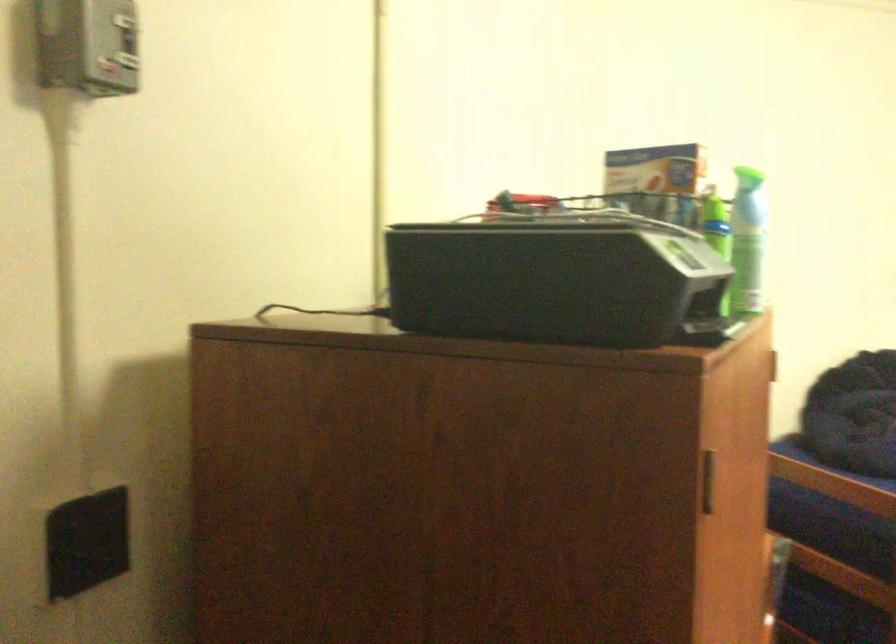
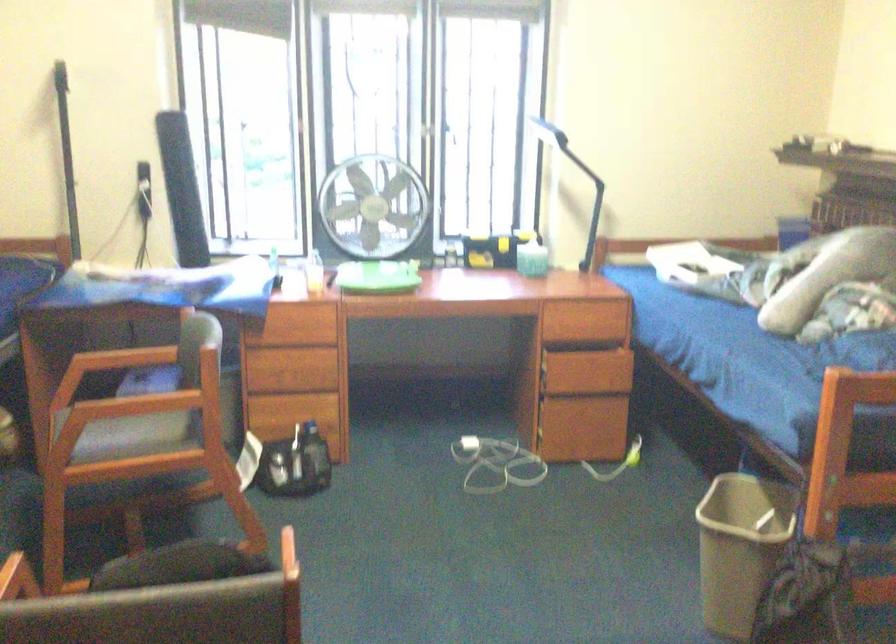
Question: The camera is either moving clockwise (left) or counter-clockwise (right) around the object. The first image is from the beginning of the video and the second image is from the end. Is the camera moving left or right when shooting the video?

Choices:
 (A) Left
 (B) Right

Answer: (A)